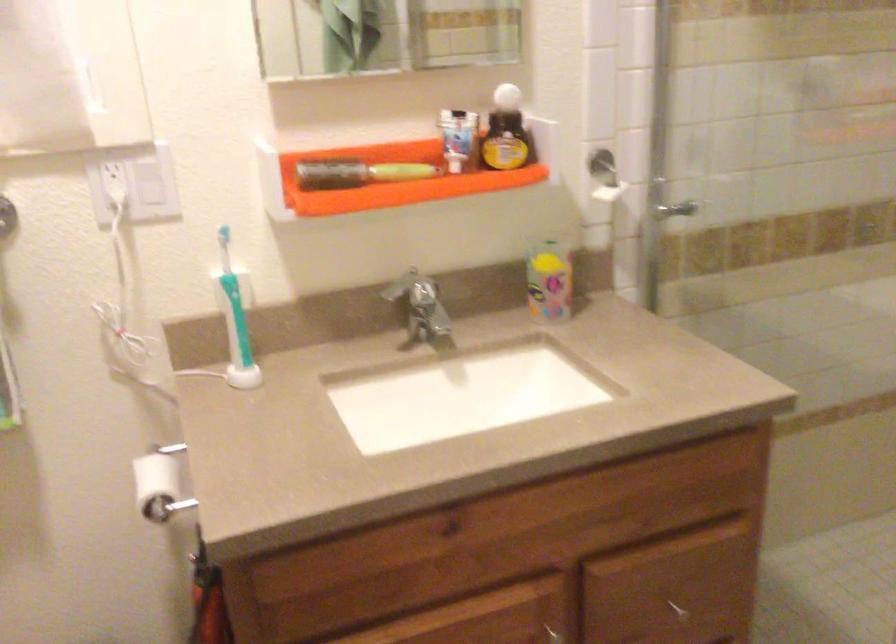
The location [234,304] corresponds to which object?

This point indicates the teal electric toothbrush.